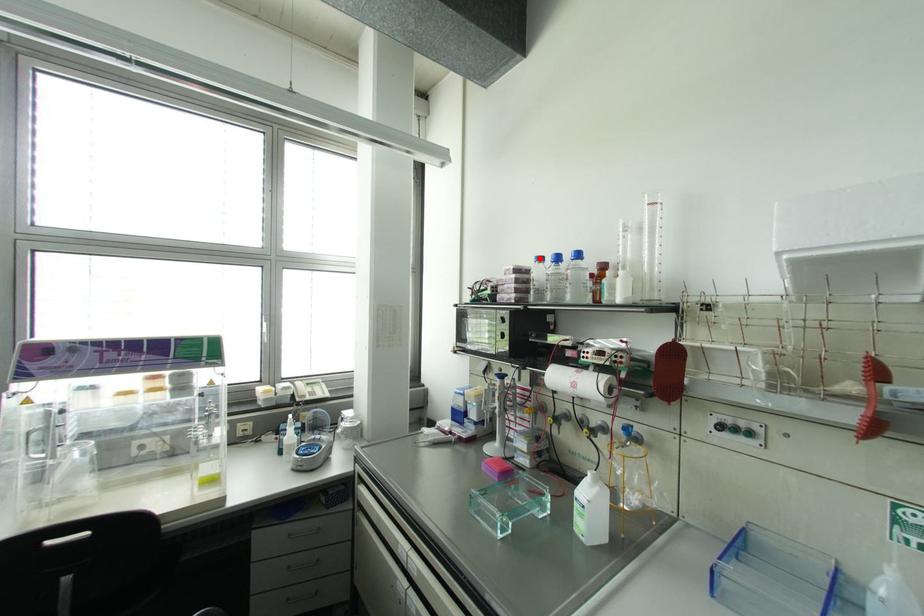
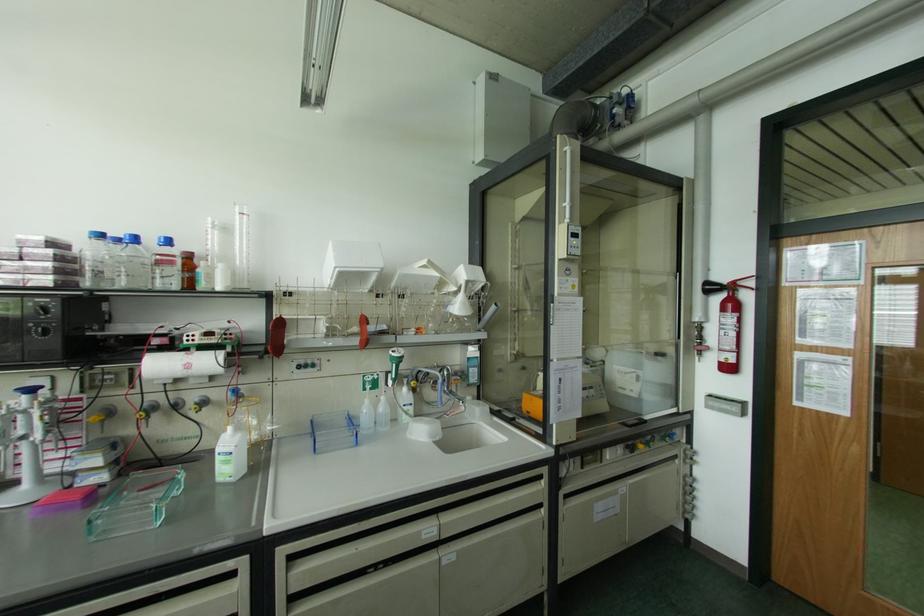
The point at the highlighted location is marked in the first image. Where is the corresponding point in the second image?

(101, 236)